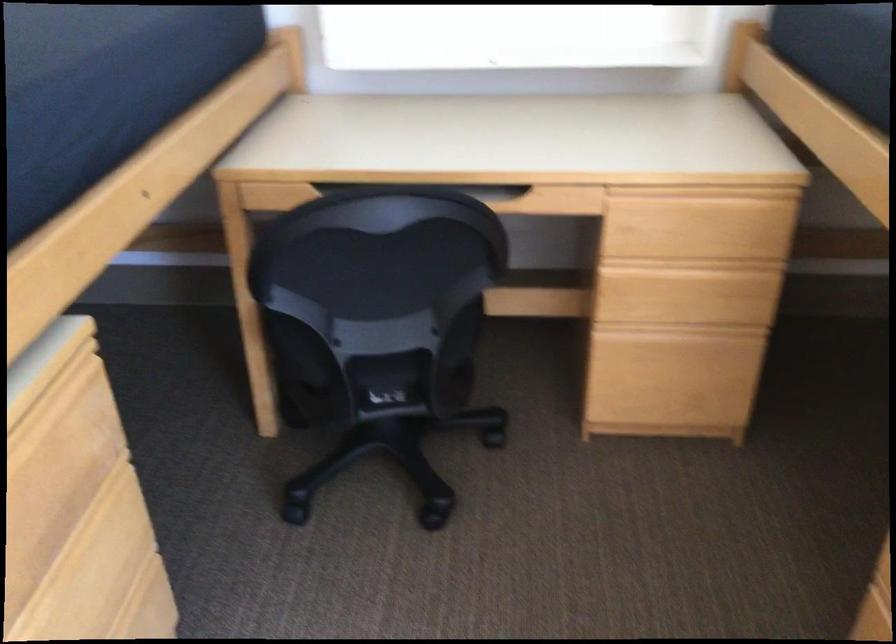
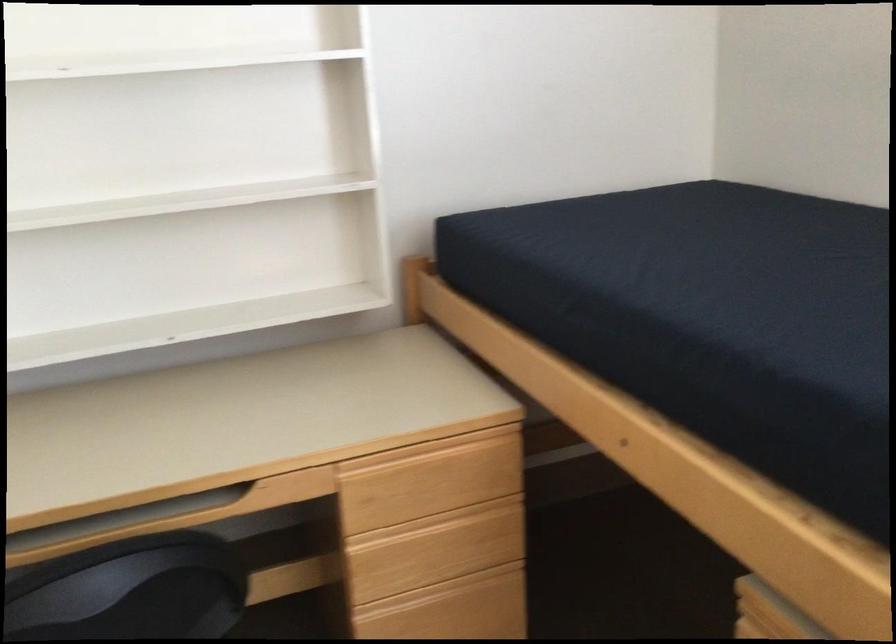
Find the pixel in the second image that matches (x=692, y=269) in the first image.

(443, 524)